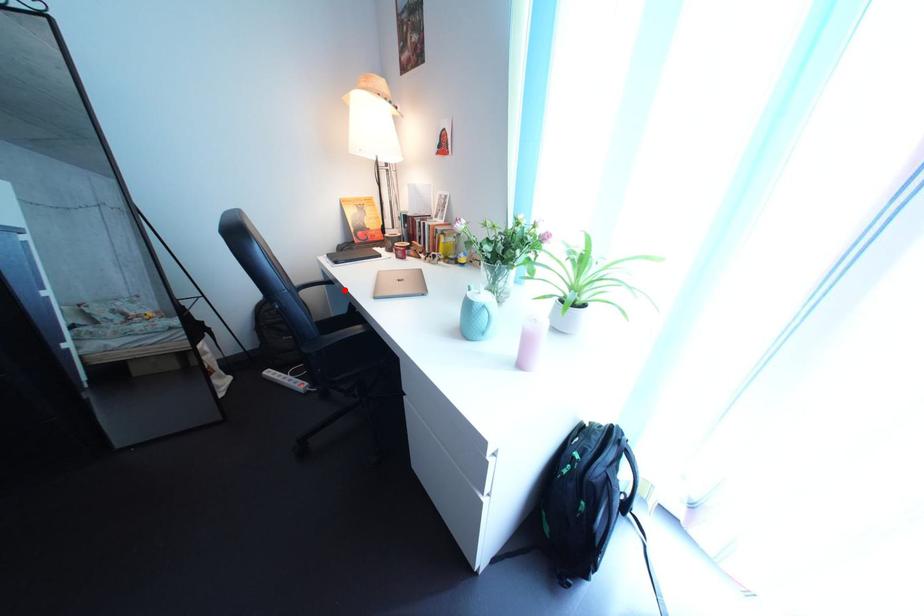
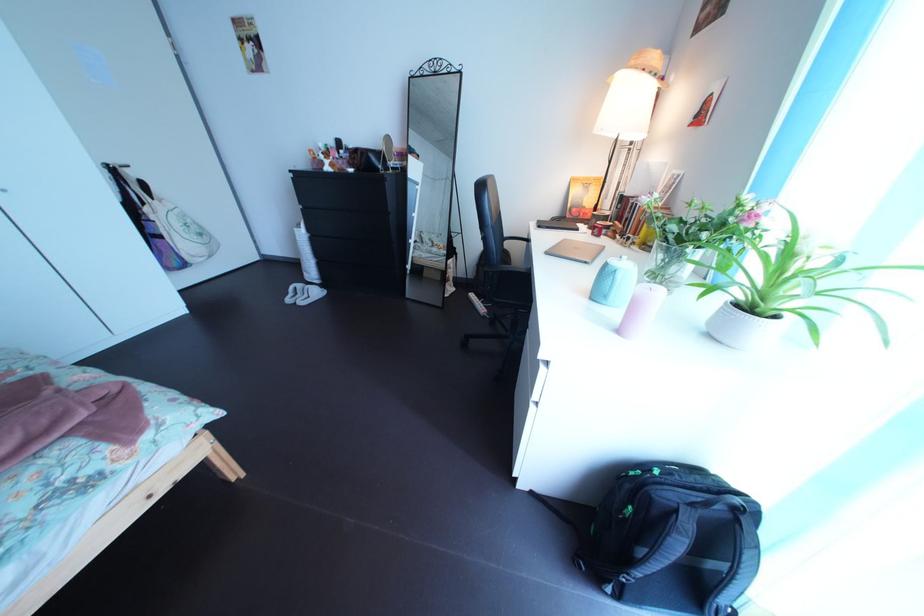
Question: I am providing you with two images of the same scene from different viewpoints. In image1, a red point is highlighted. Considering the same 3D point in image2, which of the following is correct?

Choices:
 (A) It is closer
 (B) It is farther

Answer: (A)